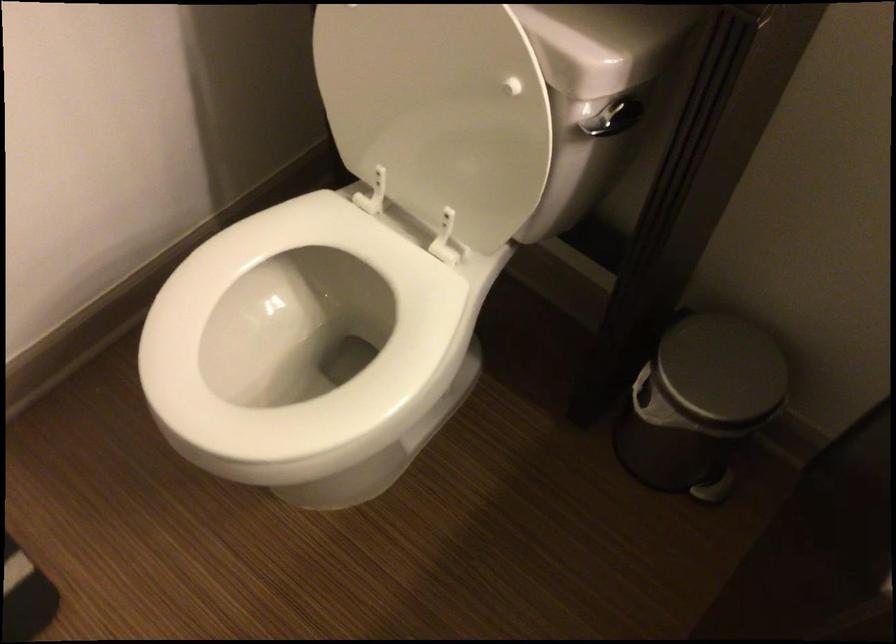
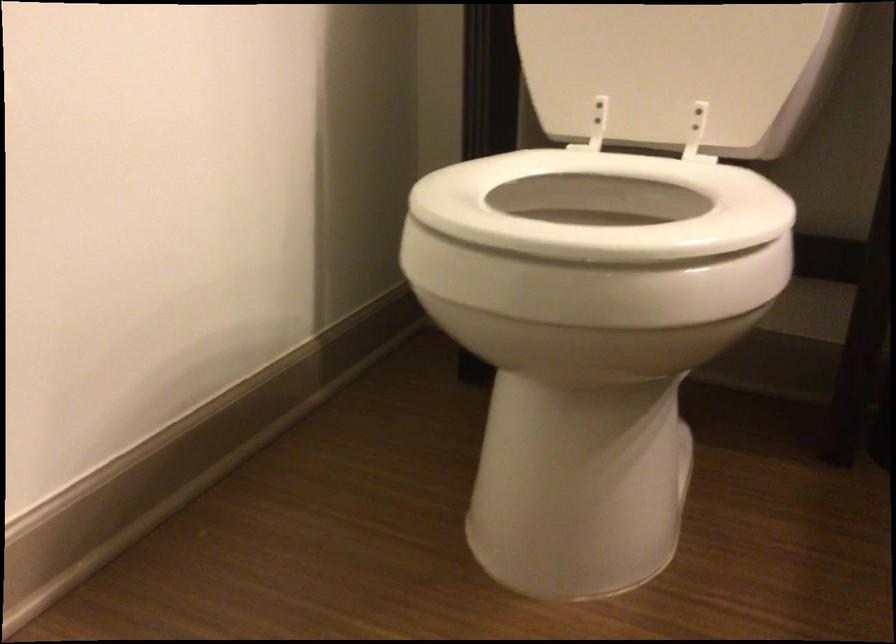
The point at [433,171] is marked in the first image. Where is the corresponding point in the second image?

(677, 71)